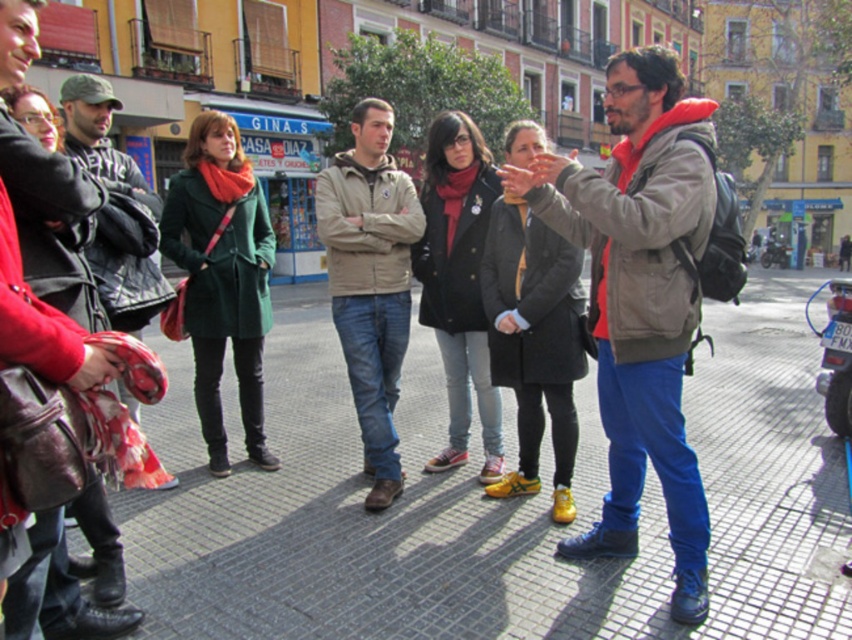
Question: Can you confirm if matte gray jacket at center is positioned to the left of matte black jacket at left?

Choices:
 (A) yes
 (B) no

Answer: (B)

Question: Among these points, which one is nearest to the camera?

Choices:
 (A) (45, 253)
 (B) (406, 326)
 (C) (303, 291)

Answer: (A)

Question: Which is nearer to the matte gray jacket at center?

Choices:
 (A) gray concrete pavement at center
 (B) matte beige jacket at center
 (C) matte black jacket at left

Answer: (B)

Question: Is matte beige jacket at center to the left of matte black jacket at left from the viewer's perspective?

Choices:
 (A) yes
 (B) no

Answer: (B)

Question: Does matte beige jacket at center have a greater width compared to matte black jacket at left?

Choices:
 (A) no
 (B) yes

Answer: (B)

Question: Which object appears farthest from the camera in this image?

Choices:
 (A) gray concrete pavement at center
 (B) matte black jacket at left
 (C) matte beige jacket at center

Answer: (C)